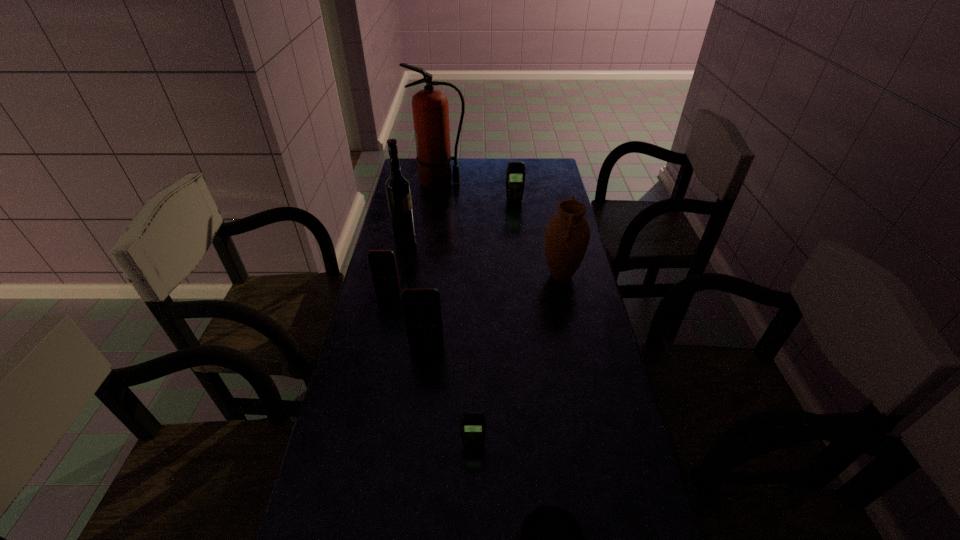
The image size is (960, 540). Identify the location of vacant region at the far right corner. (527, 160).

This screenshot has width=960, height=540. Find the location of `vacant point located between the third nearest cellular telephone and the right gray cellular telephone`. vacant point located between the third nearest cellular telephone and the right gray cellular telephone is located at coordinates (451, 247).

Find the location of a particular element. free spot between the smaller orange cellular telephone and the shortest object is located at coordinates (431, 369).

The width and height of the screenshot is (960, 540). Identify the location of vacant space that is in between the fire extinguisher and the rightmost object. (500, 230).

Image resolution: width=960 pixels, height=540 pixels. I want to click on free area in between the nearer gray cellular telephone and the bigger gray cellular telephone, so click(493, 323).

Locate an element on the screen. object identified as the fifth closest to the chalice is located at coordinates (398, 190).

The image size is (960, 540). Find the location of `the closest object to the nearest object`. the closest object to the nearest object is located at coordinates (472, 424).

The width and height of the screenshot is (960, 540). Find the location of `the third closest cellular telephone to the nearer gray cellular telephone`. the third closest cellular telephone to the nearer gray cellular telephone is located at coordinates (515, 176).

This screenshot has width=960, height=540. What are the coordinates of `cellular telephone that is the closest one to the wine bottle` in the screenshot? It's located at (383, 266).

In order to click on orange cellular telephone identified as the second closest to the rightmost object in this screenshot , I will do `click(383, 266)`.